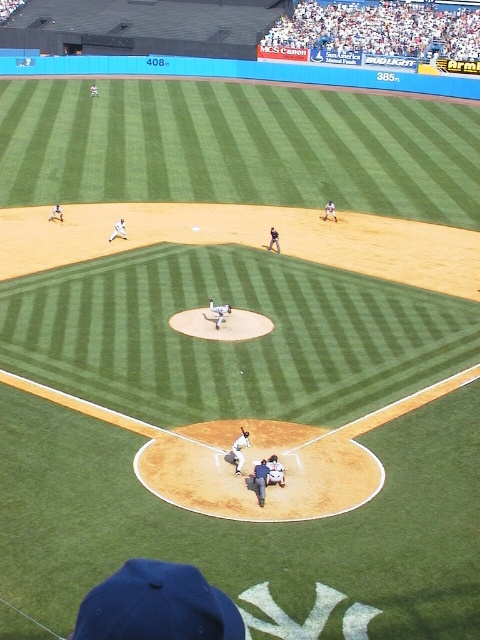
You are a photographer at the stadium and want to capture both the blue fabric referee at center and the white matte baseball player at upper left in a single shot. Which of the two will appear smaller in the photo?

The blue fabric referee at center will appear smaller in the photo because it has a smaller size compared to the white matte baseball player at upper left.

You are a spectator at the baseball game and want to know which of the two figures, the blue fabric referee at center or the white matte baseball player at upper left, is shorter. Can you determine this based on your observation?

The blue fabric referee at center is shorter than the white matte baseball player at upper left.

You are a photographer standing at the camera position trying to capture a closeup shot of the pitcher. The lens you have can focus on subjects within 70 feet. Is the point at coordinates point [266,481] within the focus range of your lens?

The distance between point [266,481] and the camera is 68.16 feet, which is within the 70 feet focus range of the lens. Therefore, the photographer can capture a clear closeup shot of the pitcher at that point.